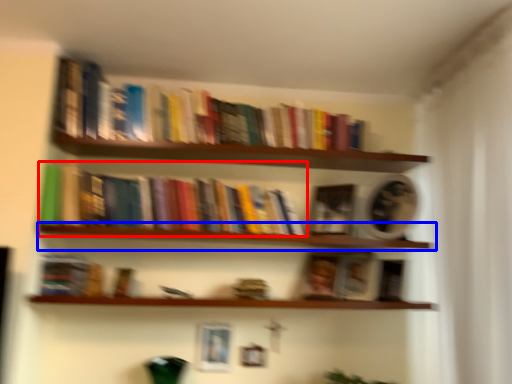
Question: Which object is closer to the camera taking this photo, book (highlighted by a red box) or window sill (highlighted by a blue box)?

Choices:
 (A) book
 (B) window sill

Answer: (B)